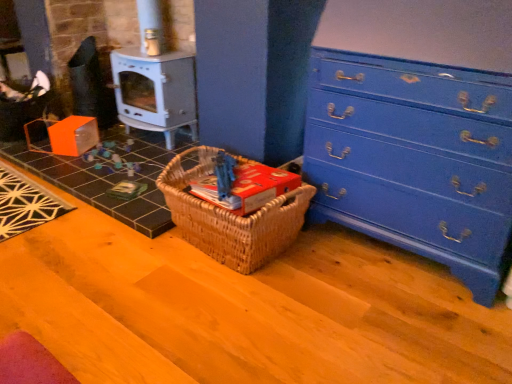
Question: Is orange cardboard box at lower left shorter than woven wood picnic basket at center?

Choices:
 (A) no
 (B) yes

Answer: (B)

Question: Would you say orange cardboard box at lower left is a long distance from woven wood picnic basket at center?

Choices:
 (A) no
 (B) yes

Answer: (A)

Question: Is orange cardboard box at lower left positioned in front of woven wood picnic basket at center?

Choices:
 (A) yes
 (B) no

Answer: (B)

Question: Is orange cardboard box at lower left positioned behind woven wood picnic basket at center?

Choices:
 (A) no
 (B) yes

Answer: (B)

Question: Considering the relative sizes of orange cardboard box at lower left and woven wood picnic basket at center in the image provided, is orange cardboard box at lower left bigger than woven wood picnic basket at center?

Choices:
 (A) yes
 (B) no

Answer: (B)

Question: Is orange cardboard box at lower left at the left side of woven wood picnic basket at center?

Choices:
 (A) no
 (B) yes

Answer: (B)

Question: Is metallic gray stove at center left oriented towards blue painted wood chest of drawers at right?

Choices:
 (A) no
 (B) yes

Answer: (A)

Question: From a real-world perspective, is metallic gray stove at center left over blue painted wood chest of drawers at right?

Choices:
 (A) yes
 (B) no

Answer: (B)

Question: Considering the relative positions of metallic gray stove at center left and blue painted wood chest of drawers at right in the image provided, is metallic gray stove at center left to the right of blue painted wood chest of drawers at right from the viewer's perspective?

Choices:
 (A) yes
 (B) no

Answer: (B)

Question: Is metallic gray stove at center left located outside blue painted wood chest of drawers at right?

Choices:
 (A) no
 (B) yes

Answer: (B)

Question: Is metallic gray stove at center left surrounding blue painted wood chest of drawers at right?

Choices:
 (A) no
 (B) yes

Answer: (A)

Question: Is metallic gray stove at center left shorter than blue painted wood chest of drawers at right?

Choices:
 (A) no
 (B) yes

Answer: (B)

Question: Are orange cardboard box at lower left and metallic gray stove at center left making contact?

Choices:
 (A) yes
 (B) no

Answer: (B)